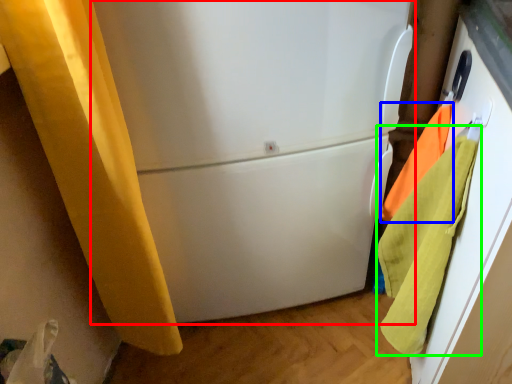
Question: Which object is positioned farthest from refrigerator (highlighted by a red box)? Select from beach towel (highlighted by a blue box) and beach towel (highlighted by a green box).

Choices:
 (A) beach towel
 (B) beach towel

Answer: (A)